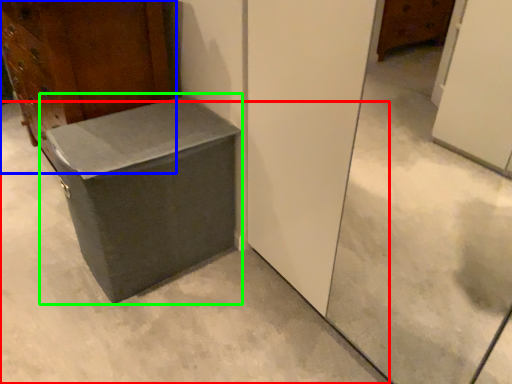
Question: Which is nearer to the concrete (highlighted by a red box)? furniture (highlighted by a blue box) or cardboard box (highlighted by a green box).

Choices:
 (A) furniture
 (B) cardboard box

Answer: (B)